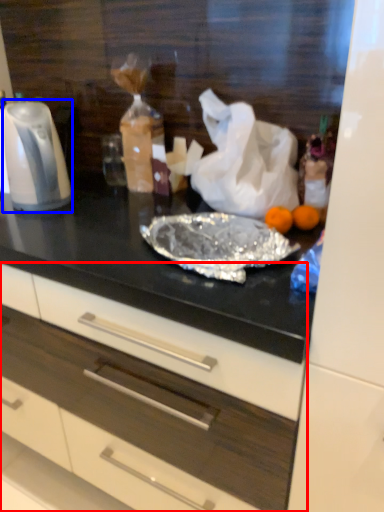
Question: Which of the following is the closest to the observer, drawer (highlighted by a red box) or kitchen appliance (highlighted by a blue box)?

Choices:
 (A) drawer
 (B) kitchen appliance

Answer: (A)